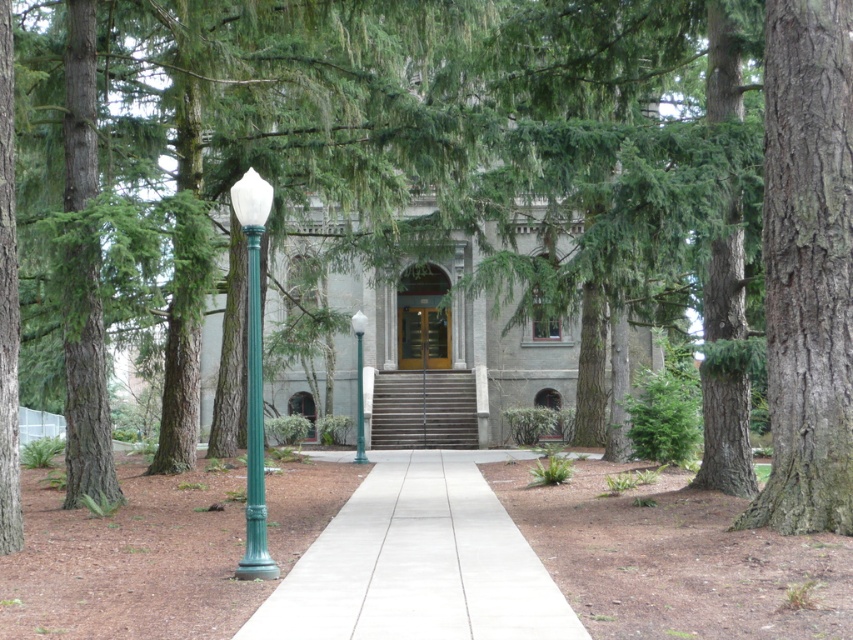
You are standing at the entrance of the grand building and want to take a photo of two specific points in the scene. The first point is labeled as point (256, 488), and the second is point (363, 438). To ensure both points are in focus, which point should you focus on first?

You should focus on point (256, 488) first because it is closer to the camera than point (363, 438), so adjusting focus starting from the closer point will help ensure both are in focus.

You are a gardener who needs to place a new bench between the smooth bark tree at right and the green glass pole at center. Considering their widths, which object should the bench be placed closer to to ensure it doesn

The bench should be placed closer to the smooth bark tree at right because its width is narrower than the green glass pole at center, allowing more space for the bench.

You are standing at the entrance of the grand building and see a point marked at coordinates (807, 266). What object is located at that point?

The point at coordinates (807, 266) indicates a smooth bark tree at the right.